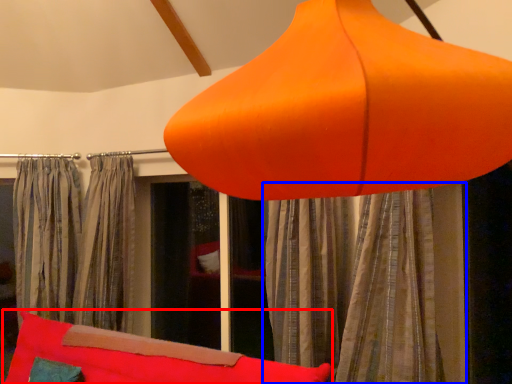
Question: Which object is closer to the camera taking this photo, bean bag chair (highlighted by a red box) or curtain (highlighted by a blue box)?

Choices:
 (A) bean bag chair
 (B) curtain

Answer: (A)